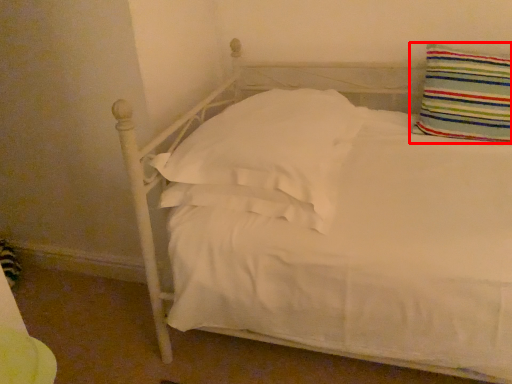
Question: From the image's perspective, where is pillow (annotated by the red box) located in relation to pillow in the image?

Choices:
 (A) above
 (B) below

Answer: (A)